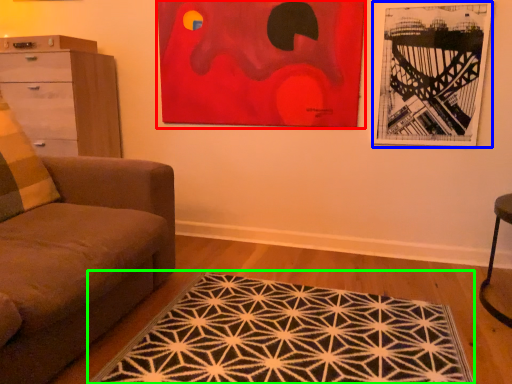
Question: Which is nearer to the picture frame (highlighted by a red box)? picture frame (highlighted by a blue box) or mat (highlighted by a green box).

Choices:
 (A) picture frame
 (B) mat

Answer: (A)